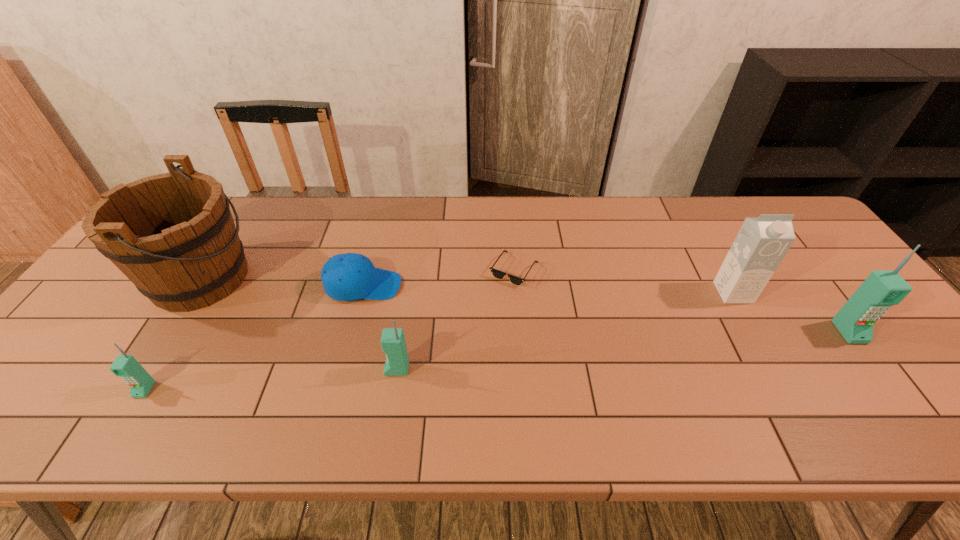
You are a GUI agent. You are given a task and a screenshot of the screen. Output one action in this format:
    pyautogui.click(x=<x>, y=<y>)
    Task: Click on the free space between the second cellular telephone from right to left and the shortest object
    This screenshot has width=960, height=540.
    Given the screenshot: What is the action you would take?
    pyautogui.click(x=456, y=320)

This screenshot has width=960, height=540. What are the coordinates of `vacant space that is in between the wine bucket and the second nearest cellular telephone` in the screenshot? It's located at [299, 323].

Identify the location of free point between the shortest cellular telephone and the wine bucket. Image resolution: width=960 pixels, height=540 pixels. (173, 334).

This screenshot has height=540, width=960. Find the location of `vacant region between the tallest cellular telephone and the sunglasses`. vacant region between the tallest cellular telephone and the sunglasses is located at coordinates (682, 301).

Where is `vacant area between the shortest cellular telephone and the second object from right to left`? Image resolution: width=960 pixels, height=540 pixels. vacant area between the shortest cellular telephone and the second object from right to left is located at coordinates (439, 341).

Identify the location of blank region between the shortest cellular telephone and the wine bucket. (173, 334).

Where is `empty location between the second shortest object and the wine bucket`? The image size is (960, 540). empty location between the second shortest object and the wine bucket is located at coordinates (282, 282).

Locate an element on the screen. The width and height of the screenshot is (960, 540). vacant region between the cap and the second object from right to left is located at coordinates (548, 289).

Image resolution: width=960 pixels, height=540 pixels. Find the location of `free spot between the fifth object from left to right and the second shortest cellular telephone`. free spot between the fifth object from left to right and the second shortest cellular telephone is located at coordinates (456, 320).

Identify which object is the sixth closest to the cap. Please provide its 2D coordinates. Your answer should be formatted as a tuple, i.e. [(x, y)], where the tuple contains the x and y coordinates of a point satisfying the conditions above.

[(855, 320)]